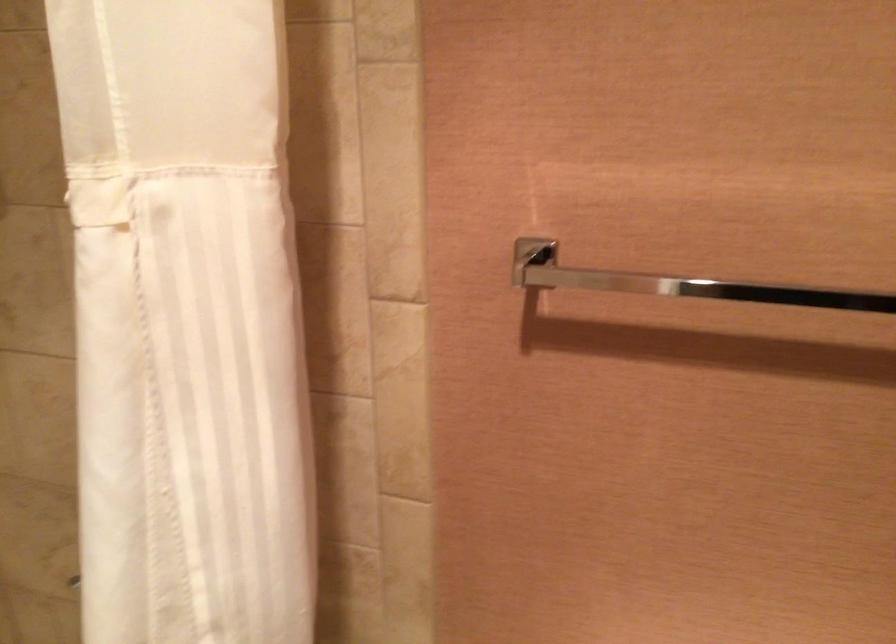
Question: The first image is from the beginning of the video and the second image is from the end. How did the camera likely rotate when shooting the video?

Choices:
 (A) Left
 (B) Right
 (C) Up
 (D) Down

Answer: (B)